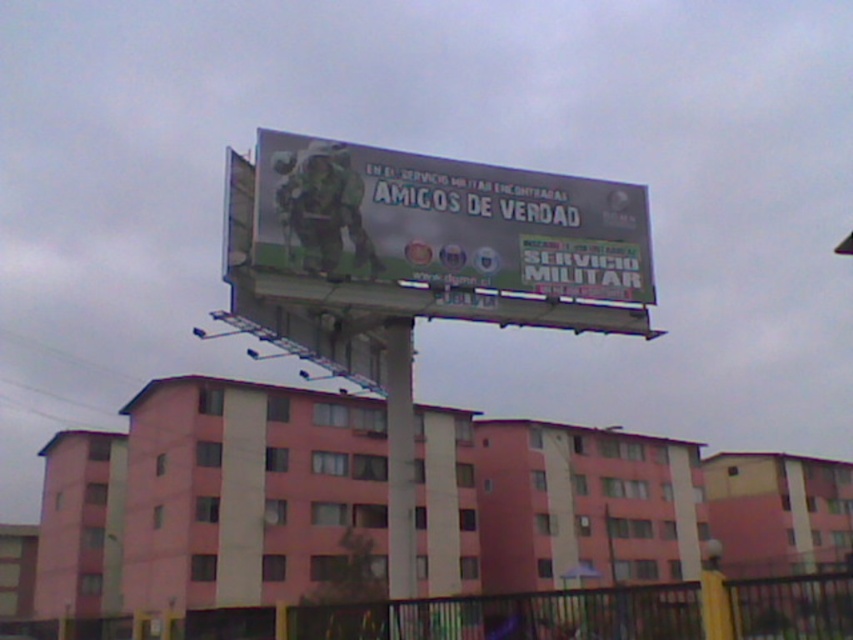
Who is lower down, metallic silver soldier at center or metallic pole at center?

Positioned lower is metallic pole at center.

Is the position of metallic silver soldier at center more distant than that of metallic pole at center?

Yes.

Which is in front, point (383, 211) or point (399, 451)?

Positioned in front is point (383, 211).

This screenshot has width=853, height=640. I want to click on metallic silver soldier at center, so click(445, 221).